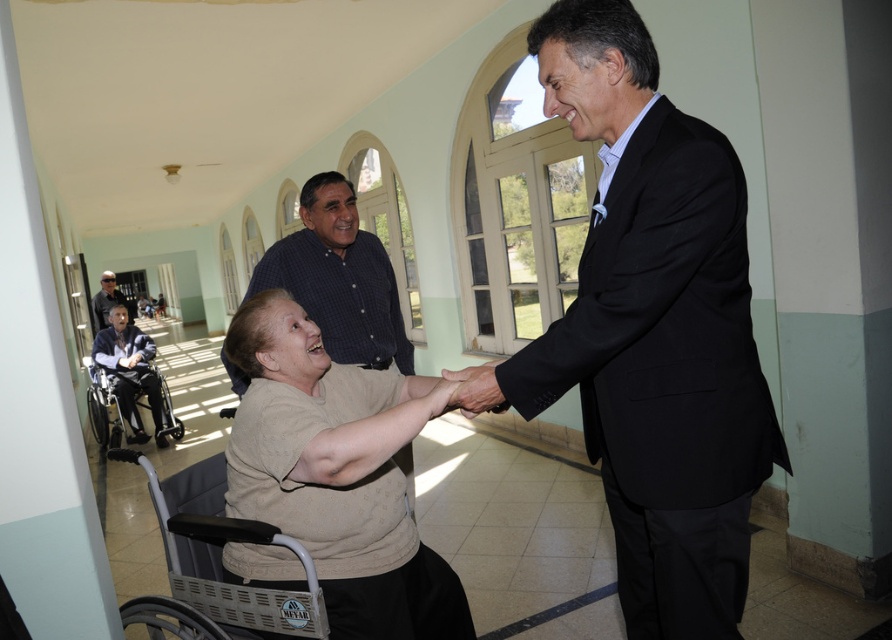
Question: Which point is farther from the camera taking this photo?

Choices:
 (A) (87, 397)
 (B) (460, 385)

Answer: (A)

Question: Which of the following is the farthest from the observer?

Choices:
 (A) beige fabric shirt at center
 (B) dark blue textured shirt at center
 (C) gray plastic wheelchair at lower left

Answer: (C)

Question: Which of the following is the closest to the observer?

Choices:
 (A) (384, 308)
 (B) (643, 204)
 (C) (448, 378)
 (D) (114, 433)

Answer: (B)

Question: Is black suit at center thinner than smooth skin hand at center?

Choices:
 (A) yes
 (B) no

Answer: (B)

Question: Does black suit at center have a smaller size compared to beige fabric shirt at center?

Choices:
 (A) yes
 (B) no

Answer: (B)

Question: Is black suit at center further to camera compared to beige fabric shirt at center?

Choices:
 (A) no
 (B) yes

Answer: (A)